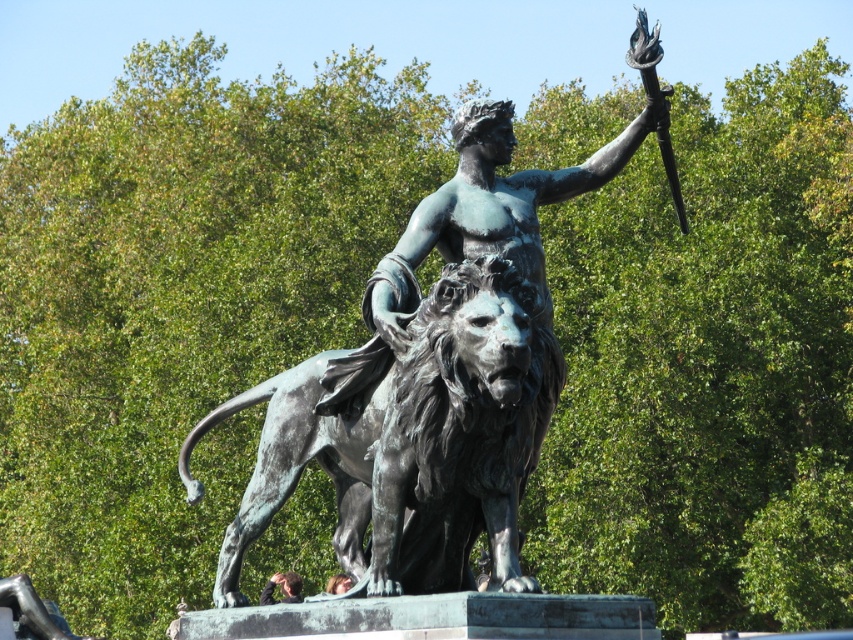
You are an art conservator tasked with measuring the distance between the two main components of the statue. You have a measuring tape that can extend up to 1 meter. Can you measure the distance between the bronze statue at center and the bronze textured lion at center without needing to extend the tape beyond its limit?

The bronze statue at center and bronze textured lion at center are 1.09 meters apart from each other. Since the measuring tape can only extend up to 1 meter, the tape is not long enough to measure the distance between the bronze statue at center and the bronze textured lion at center without extending beyond its limit.

You are standing at the point marked as point (422, 461). You want to take a photo of the bronze statue of the heroic figure riding a lion. To get the best shot, you need to be exactly 60 meters away from the statue. Should you move closer or farther away from the statue?

The distance between point (422, 461) and the camera is 61.54 meters. Since you need to be exactly 60 meters away, you should move closer to the statue by approximately 1.54 meters.